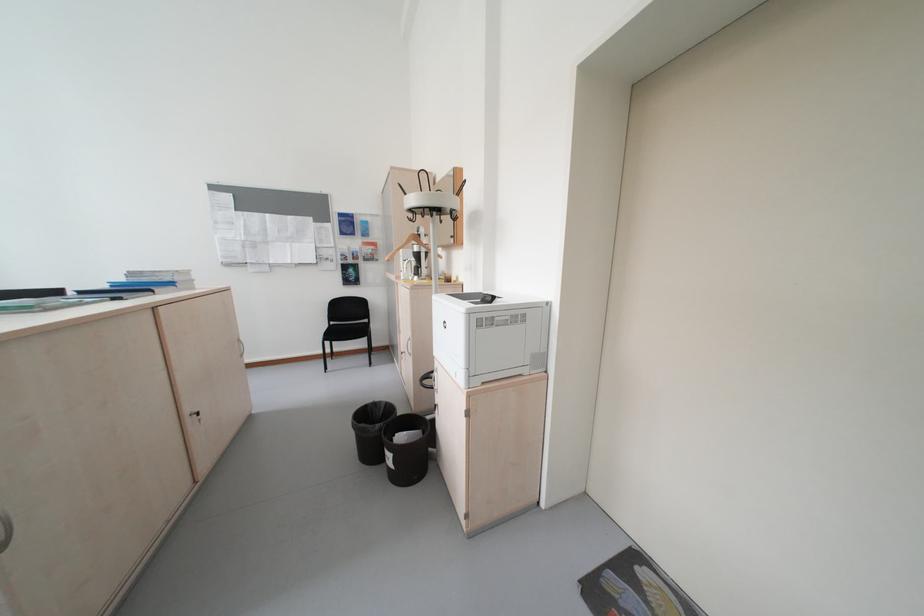
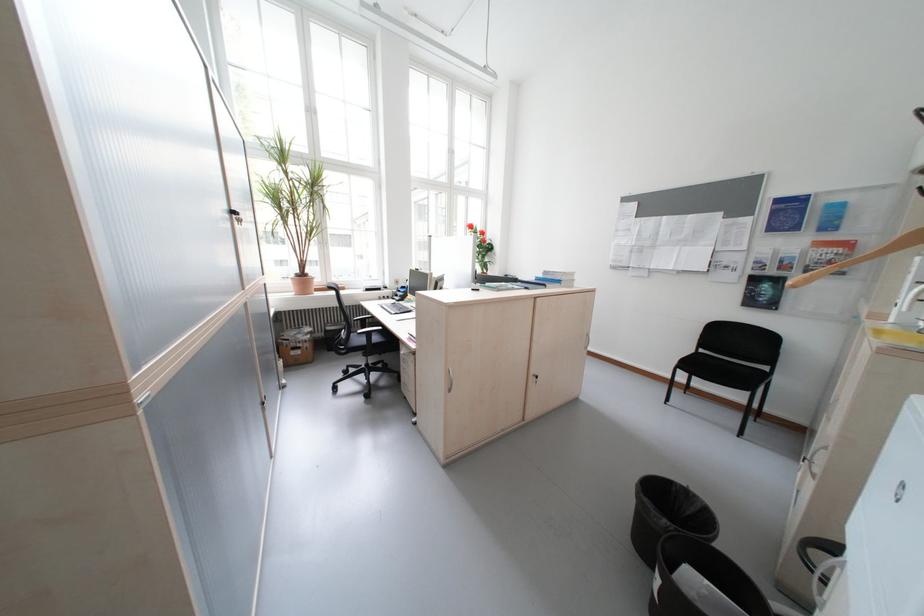
Find the pixel in the second image that matches (366,267) in the first image.

(788, 282)